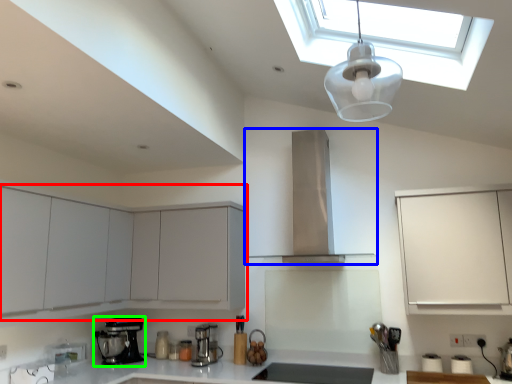
Question: Considering the real-world distances, which object is closest to cabinetry (highlighted by a red box)? home appliance (highlighted by a blue box) or kitchen appliance (highlighted by a green box).

Choices:
 (A) home appliance
 (B) kitchen appliance

Answer: (B)